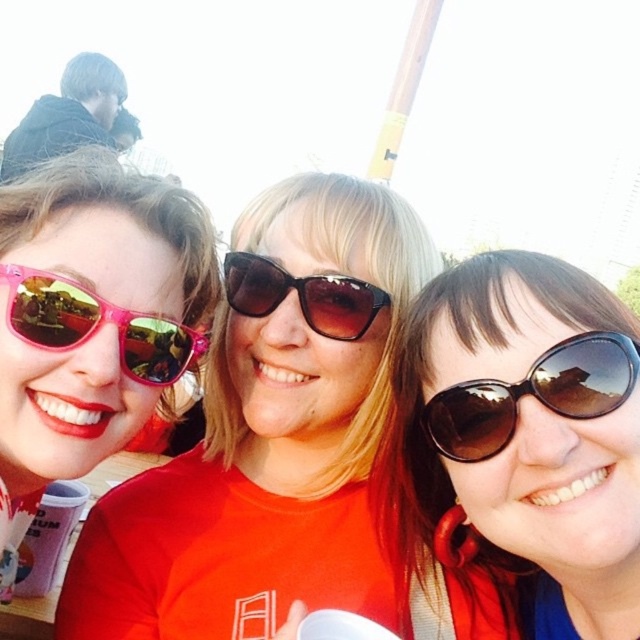
You are taking a selfie with three friends. You notice a point at coordinates (532, 394) on your phone screen. Based on the scene description, which object does this point correspond to?

The point at coordinates (532, 394) corresponds to the brown reflective sunglasses at right.

You are trying to decide which pair of sunglasses to buy based on their size. You prefer a taller pair. Looking at the pink matte sunglasses at left and the brown reflective sunglasses at right in the image, which one should you choose?

The pink matte sunglasses at left has a greater height compared to the brown reflective sunglasses at right, so you should choose the pink matte sunglasses at left.

You are a photographer trying to focus on the brown reflective sunglasses at right and the brown gradient plastic sunglasses at center. Which pair of sunglasses is closer to you?

The brown reflective sunglasses at right is closer to the viewer than the brown gradient plastic sunglasses at center.